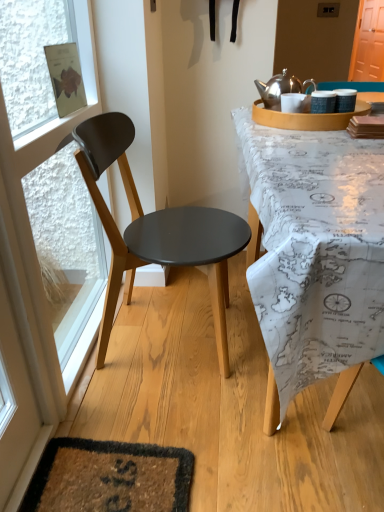
Question: Does transparent glass door at left have a lesser height compared to orange wood screen door at upper right?

Choices:
 (A) yes
 (B) no

Answer: (B)

Question: Is the position of transparent glass door at left less distant than that of orange wood screen door at upper right?

Choices:
 (A) yes
 (B) no

Answer: (A)

Question: Does transparent glass door at left appear on the left side of orange wood screen door at upper right?

Choices:
 (A) yes
 (B) no

Answer: (A)

Question: Is the position of transparent glass door at left more distant than that of orange wood screen door at upper right?

Choices:
 (A) no
 (B) yes

Answer: (A)

Question: Is transparent glass door at left facing away from orange wood screen door at upper right?

Choices:
 (A) no
 (B) yes

Answer: (A)

Question: Is transparent glass door at left not inside orange wood screen door at upper right?

Choices:
 (A) no
 (B) yes

Answer: (B)

Question: From a real-world perspective, is orange wood screen door at upper right over transparent glass door at left?

Choices:
 (A) no
 (B) yes

Answer: (B)

Question: From the image's perspective, is orange wood screen door at upper right above transparent glass door at left?

Choices:
 (A) no
 (B) yes

Answer: (B)

Question: Would you say transparent glass door at left is part of orange wood screen door at upper right's contents?

Choices:
 (A) no
 (B) yes

Answer: (A)

Question: Is orange wood screen door at upper right aimed at transparent glass door at left?

Choices:
 (A) yes
 (B) no

Answer: (B)

Question: Is orange wood screen door at upper right outside transparent glass door at left?

Choices:
 (A) yes
 (B) no

Answer: (A)

Question: Is orange wood screen door at upper right thinner than transparent glass door at left?

Choices:
 (A) yes
 (B) no

Answer: (B)

Question: From a real-world perspective, is transparent glass door at left positioned over matte black chair at left based on gravity?

Choices:
 (A) yes
 (B) no

Answer: (A)